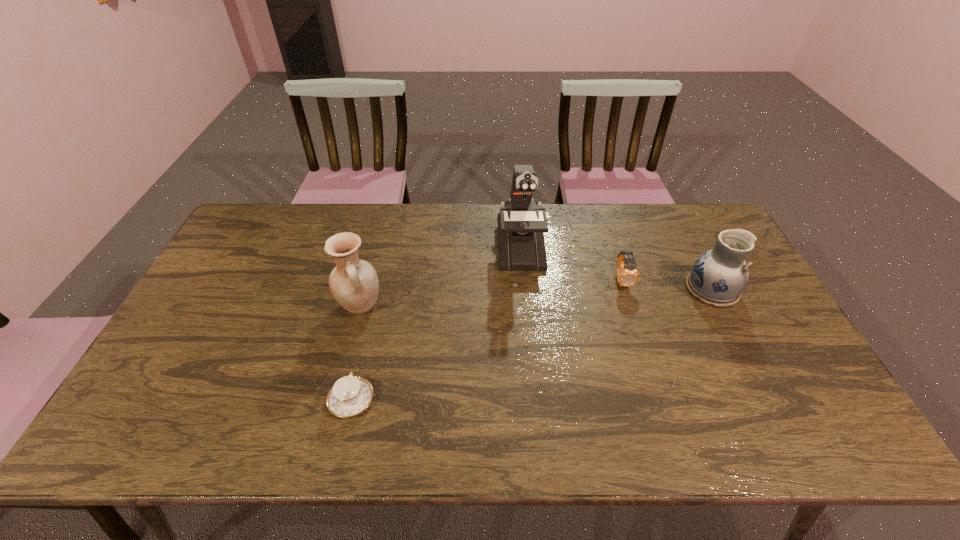
Where is `free space at the near edge of the desktop`? Image resolution: width=960 pixels, height=540 pixels. free space at the near edge of the desktop is located at coordinates (282, 416).

Where is `free space at the left edge of the desktop`? free space at the left edge of the desktop is located at coordinates (207, 355).

Image resolution: width=960 pixels, height=540 pixels. In order to click on free space at the right edge of the desktop in this screenshot , I will do `click(795, 363)`.

This screenshot has width=960, height=540. I want to click on blank space at the far left corner, so click(x=266, y=235).

This screenshot has height=540, width=960. I want to click on free spot between the second shortest object and the left pottery, so click(x=492, y=293).

Where is `free space between the teacup and the microscope`? free space between the teacup and the microscope is located at coordinates (436, 323).

Where is `vacant space that is in between the watch and the left pottery`? vacant space that is in between the watch and the left pottery is located at coordinates (492, 293).

At what (x,y) coordinates should I click in order to perform the action: click on free space between the left pottery and the microscope. Please return your answer as a coordinate pair (x, y). The image size is (960, 540). Looking at the image, I should click on (440, 276).

I want to click on unoccupied area between the left pottery and the fourth object from left to right, so point(492,293).

Where is `free spot between the shortest object and the left pottery`? free spot between the shortest object and the left pottery is located at coordinates (356, 353).